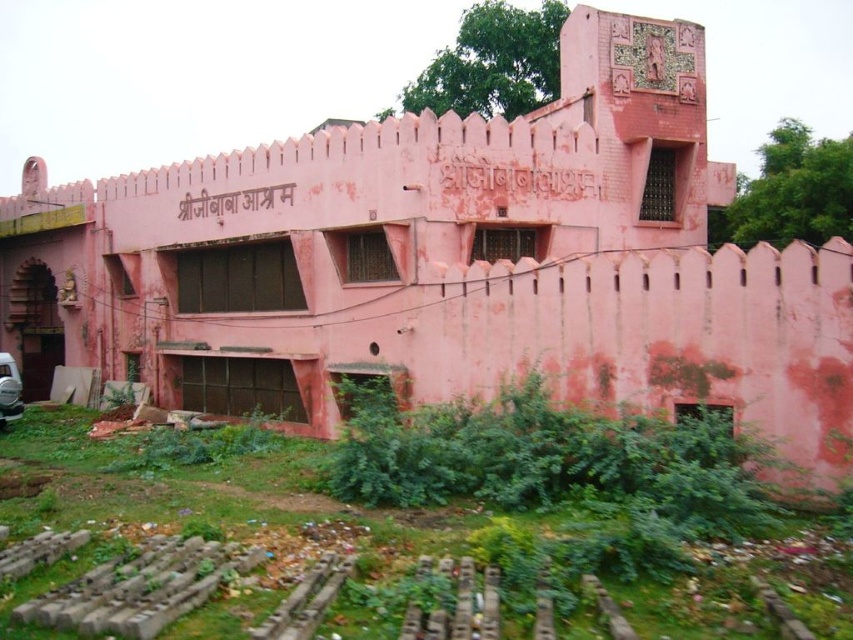
Which of these two, green grass at lower left or metallic silver car at lower left, stands taller?

Standing taller between the two is metallic silver car at lower left.

Is green grass at lower left wider than metallic silver car at lower left?

Yes, green grass at lower left is wider than metallic silver car at lower left.

In order to click on green grass at lower left in this screenshot , I will do `click(630, 508)`.